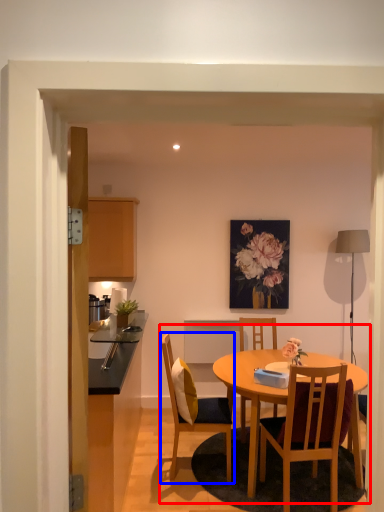
Question: Which object appears farthest to the camera in this image, kitchen & dining room table (highlighted by a red box) or chair (highlighted by a blue box)?

Choices:
 (A) kitchen & dining room table
 (B) chair

Answer: (B)